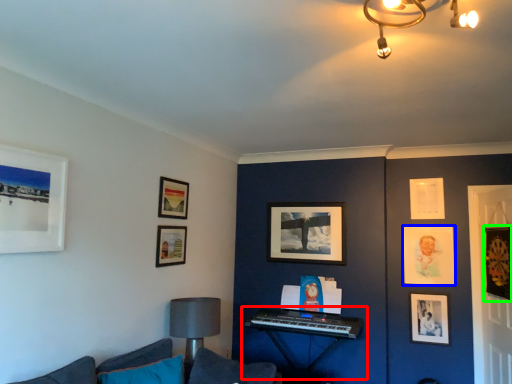
Question: Which object is positioned farthest from piano (highlighted by a red box)? Select from picture frame (highlighted by a blue box) and picture frame (highlighted by a green box).

Choices:
 (A) picture frame
 (B) picture frame

Answer: (B)